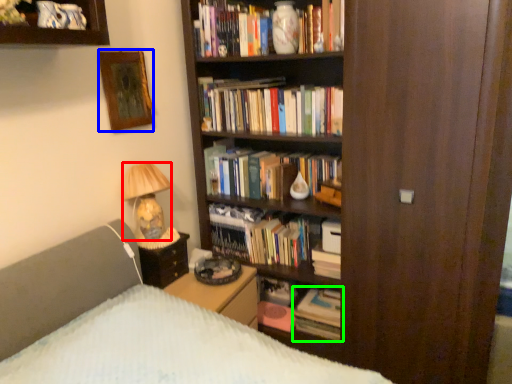
Question: Which object is positioned closest to lamp (highlighted by a red box)? Select from picture frame (highlighted by a blue box) and book (highlighted by a green box).

Choices:
 (A) picture frame
 (B) book

Answer: (A)